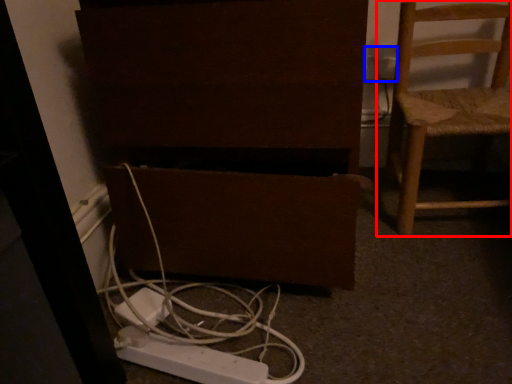
Question: Among these objects, which one is farthest to the camera, chair (highlighted by a red box) or electric outlet (highlighted by a blue box)?

Choices:
 (A) chair
 (B) electric outlet

Answer: (B)